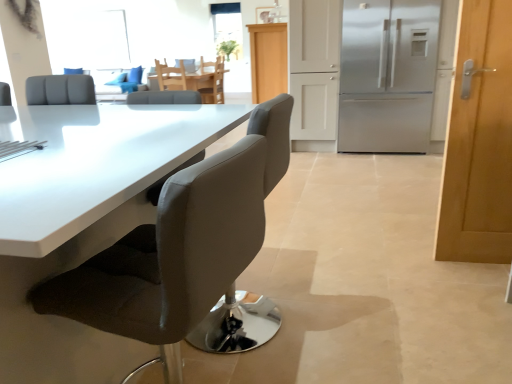
Question: Based on their sizes in the image, would you say suede-like gray chair at center, which is the 3th chair in top-to-bottom order, is bigger or smaller than satin silver refrigerator at right?

Choices:
 (A) big
 (B) small

Answer: (B)

Question: Is suede-like gray chair at center, which is the second chair in front-to-back order, inside or outside of satin silver refrigerator at right?

Choices:
 (A) outside
 (B) inside

Answer: (A)

Question: Estimate the real-world distances between objects in this image. Which object is farther from the matte gray chair at center, which is the 1th chair in front-to-back order?

Choices:
 (A) suede-like gray chair at center, which is the 3th chair in top-to-bottom order
 (B) wooden chair at center, the 2th chair in the top-to-bottom sequence
 (C) wooden door at right
 (D) light brown wooden chair at center, acting as the fourth chair starting from the bottom
 (E) wooden round table at center

Answer: (D)

Question: Considering the real-world distances, which object is closest to the wooden chair at center, the third chair from the bottom?

Choices:
 (A) matte gray chair at center, acting as the 4th chair starting from the top
 (B) wooden round table at center
 (C) wooden door at right
 (D) light wood cabinet at center
 (E) satin silver refrigerator at right

Answer: (B)